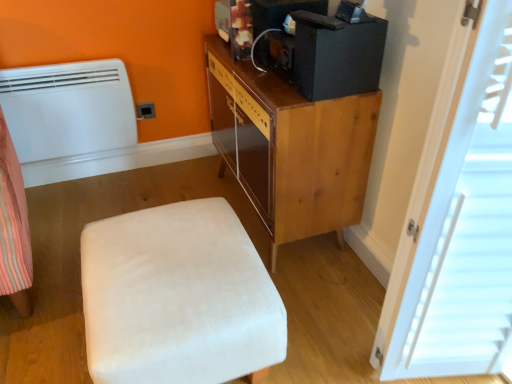
In order to click on free space above white velvety ottoman at lower left (from a real-world perspective) in this screenshot , I will do (x=174, y=275).